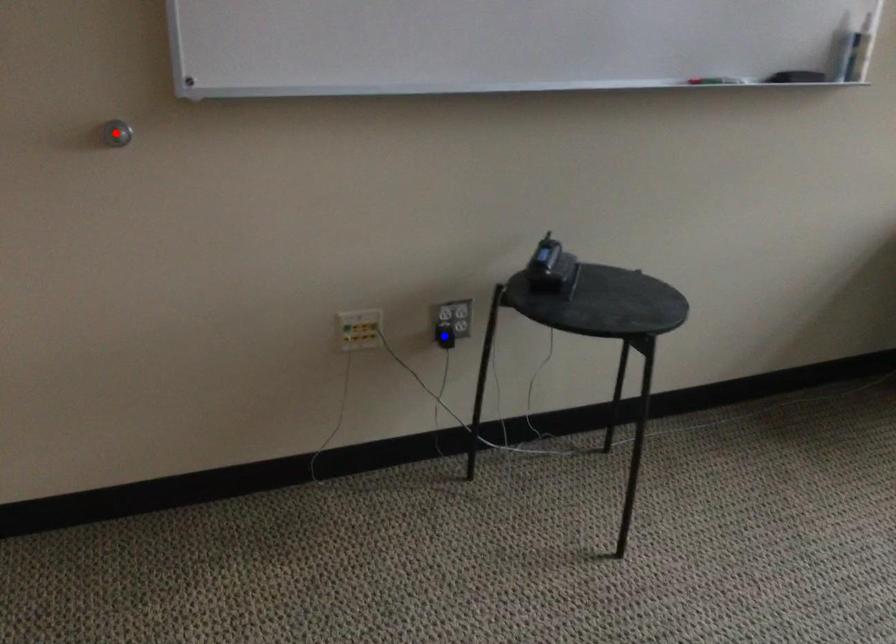
Question: Two points are marked on the image. Which point is closer to the camera?

Choices:
 (A) Blue point is closer.
 (B) Red point is closer.

Answer: (B)